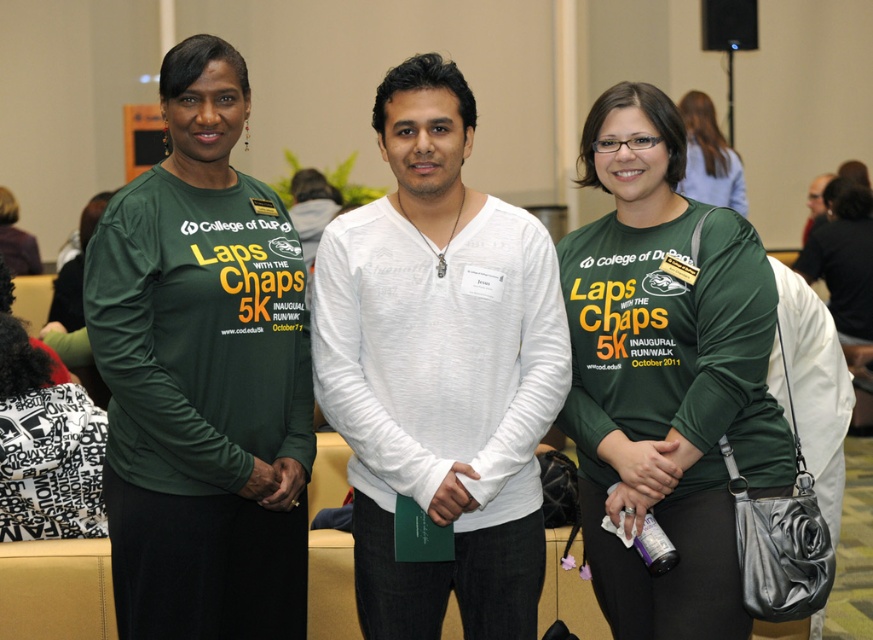
Question: Estimate the real-world distances between objects in this image. Which object is closer to the white matte paper at center?

Choices:
 (A) matte green shirt at center
 (B) white soft shirt at center
 (C) green matte long-sleeve shirt at left
 (D) green matte shirt at center

Answer: (B)

Question: Estimate the real-world distances between objects in this image. Which object is farther from the green matte long-sleeve shirt at left?

Choices:
 (A) white matte paper at center
 (B) white soft shirt at center

Answer: (A)

Question: Can you confirm if white soft shirt at center is bigger than green matte long-sleeve shirt at left?

Choices:
 (A) no
 (B) yes

Answer: (B)

Question: Is green matte shirt at center positioned before white matte paper at center?

Choices:
 (A) yes
 (B) no

Answer: (A)

Question: Can you confirm if white soft shirt at center is positioned below green matte shirt at center?

Choices:
 (A) yes
 (B) no

Answer: (B)

Question: Which object is the closest to the green matte long-sleeve shirt at left?

Choices:
 (A) white matte paper at center
 (B) green matte shirt at center
 (C) white soft shirt at center
 (D) matte green shirt at center

Answer: (C)